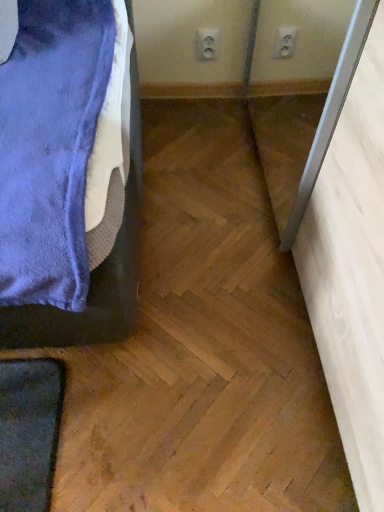
This screenshot has height=512, width=384. What do you see at coordinates (207, 44) in the screenshot?
I see `white plastic electric outlet at upper center` at bounding box center [207, 44].

Find the location of `white plastic electric outlet at upper center`. white plastic electric outlet at upper center is located at coordinates (207, 44).

In order to face white plastic electric outlet at upper center, should I rotate leftwards or rightwards?

Turn right by 2.248 degrees to look at white plastic electric outlet at upper center.

Identify the location of white plastic electric outlet at upper center. coord(207,44).